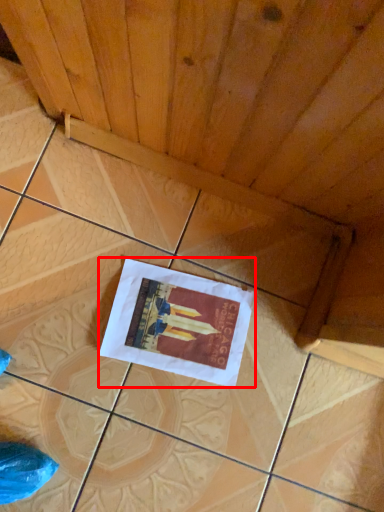
Question: From the image's perspective, considering the relative positions of poster (annotated by the red box) and plywood in the image provided, where is poster (annotated by the red box) located with respect to the staircase?

Choices:
 (A) above
 (B) below

Answer: (B)